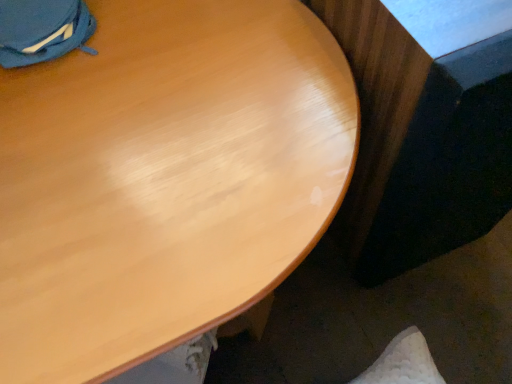
Question: Is glossy wood table at lower right aimed at glossy wood desk at upper center?

Choices:
 (A) yes
 (B) no

Answer: (B)

Question: Can you confirm if glossy wood table at lower right is wider than glossy wood desk at upper center?

Choices:
 (A) no
 (B) yes

Answer: (A)

Question: Can you confirm if glossy wood table at lower right is taller than glossy wood desk at upper center?

Choices:
 (A) no
 (B) yes

Answer: (B)

Question: From the image's perspective, is glossy wood table at lower right above glossy wood desk at upper center?

Choices:
 (A) yes
 (B) no

Answer: (A)

Question: Is glossy wood table at lower right not near glossy wood desk at upper center?

Choices:
 (A) yes
 (B) no

Answer: (B)

Question: Is glossy wood table at lower right looking in the opposite direction of glossy wood desk at upper center?

Choices:
 (A) yes
 (B) no

Answer: (B)

Question: Can glossy wood table at lower right be found inside glossy wood desk at upper center?

Choices:
 (A) yes
 (B) no

Answer: (B)

Question: Is glossy wood desk at upper center located outside glossy wood table at lower right?

Choices:
 (A) no
 (B) yes

Answer: (B)

Question: From the image's perspective, is glossy wood desk at upper center below glossy wood table at lower right?

Choices:
 (A) yes
 (B) no

Answer: (A)

Question: From a real-world perspective, does glossy wood desk at upper center sit lower than glossy wood table at lower right?

Choices:
 (A) no
 (B) yes

Answer: (B)

Question: Is glossy wood desk at upper center facing away from glossy wood table at lower right?

Choices:
 (A) yes
 (B) no

Answer: (B)

Question: Can you confirm if glossy wood desk at upper center is smaller than glossy wood table at lower right?

Choices:
 (A) yes
 (B) no

Answer: (B)

Question: Visually, is glossy wood desk at upper center positioned to the left or to the right of glossy wood table at lower right?

Choices:
 (A) right
 (B) left

Answer: (B)